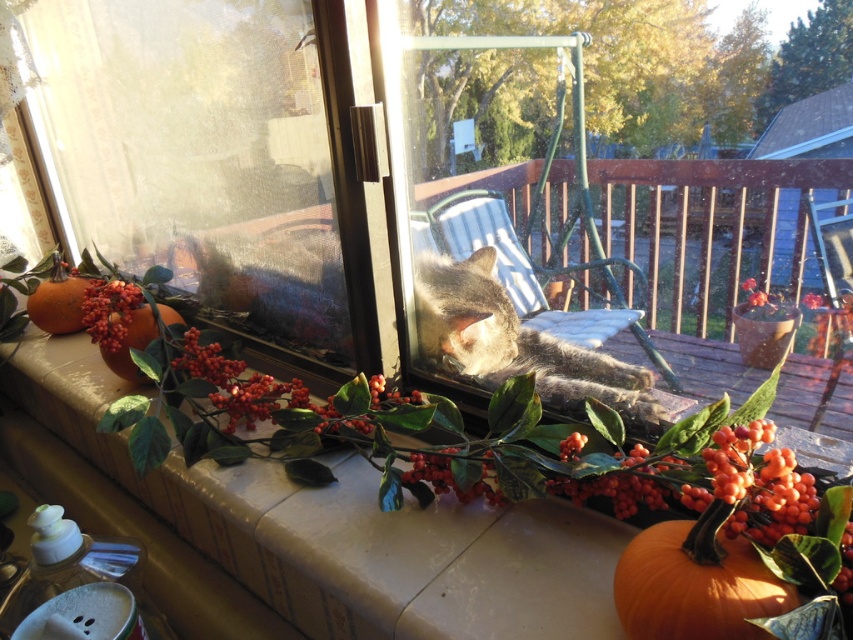
You are a window cleaner standing on the smooth stone window sill at lower center. You need to reach the matte orange pumpkin at lower left to clean it. Can you reach it from your current position?

The smooth stone window sill at lower center is located below the matte orange pumpkin at lower left, so you cannot reach the matte orange pumpkin at lower left from the smooth stone window sill at lower center.

You are a small toy mouse that is 3 inches long. You want to jump onto the smooth stone window sill at lower center from the windowsill edge. Can you make the jump?

The smooth stone window sill at lower center is 18.54 inches from the viewer. Since the toy mouse is only 3 inches long, it cannot jump that distance. It needs a closer object to jump onto.